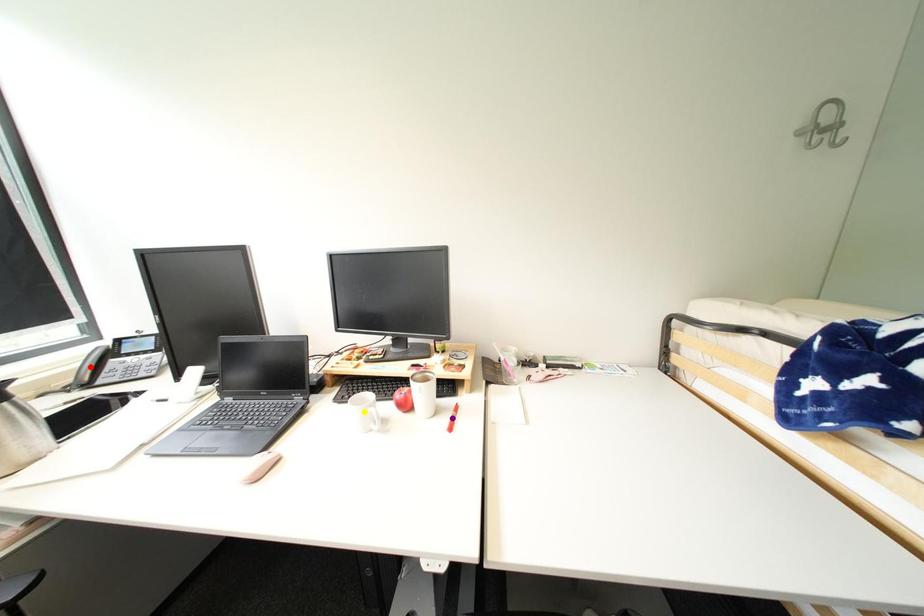
Based on the photo, order these from farthest to nearest:
A) yellow point
B) red point
C) purple point

yellow point
purple point
red point